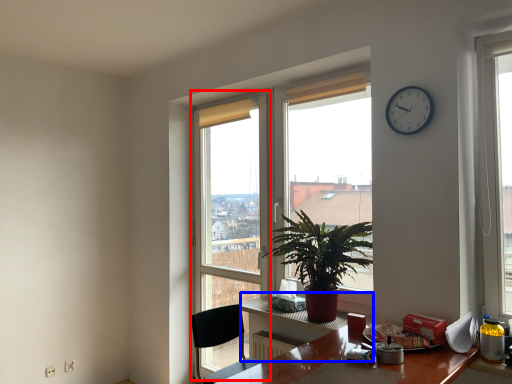
Question: Which object is closer to the camera taking this photo, glass door (highlighted by a red box) or computer desk (highlighted by a blue box)?

Choices:
 (A) glass door
 (B) computer desk

Answer: (B)